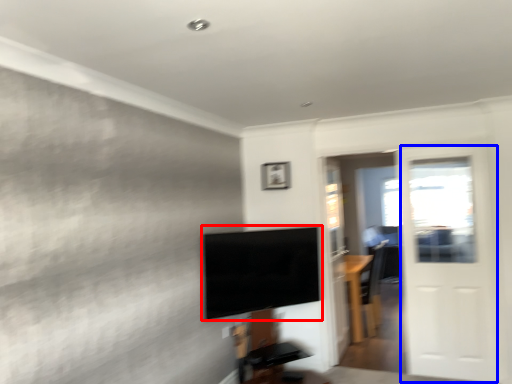
Question: Which object appears closest to the camera in this image, television (highlighted by a red box) or screen door (highlighted by a blue box)?

Choices:
 (A) television
 (B) screen door

Answer: (A)